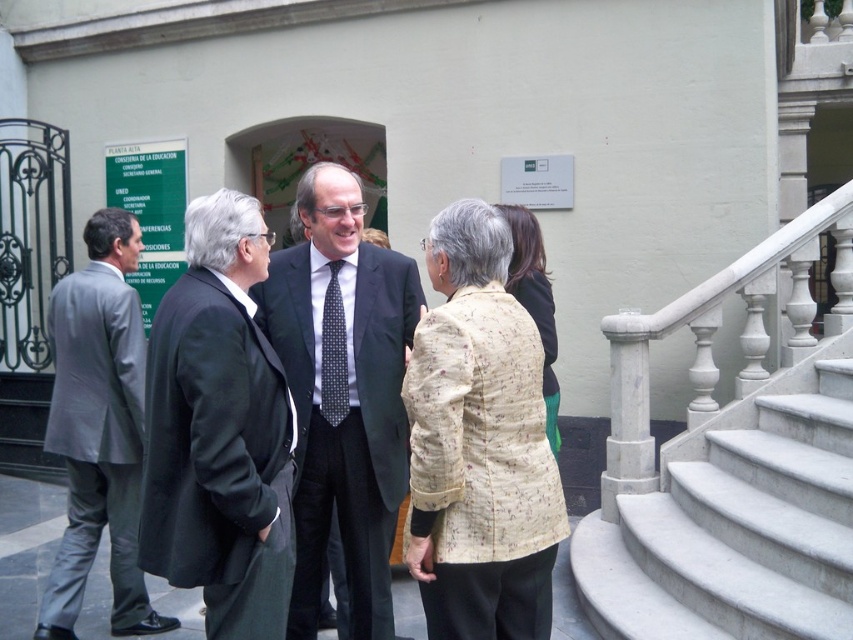
Question: Does black wool coat at center have a greater width compared to dark gray suit at center?

Choices:
 (A) yes
 (B) no

Answer: (B)

Question: Estimate the real-world distances between objects in this image. Which object is closer to the matte black suit at center?

Choices:
 (A) printed fabric jacket at center
 (B) black dotted tie at center
 (C) white marble stairs at lower right
 (D) floral-patterned fabric coat at center

Answer: (B)

Question: Estimate the real-world distances between objects in this image. Which object is farther from the floral-patterned fabric coat at center?

Choices:
 (A) white marble stairs at lower right
 (B) printed fabric jacket at center

Answer: (B)

Question: Considering the relative positions of white marble stairs at lower right and floral-patterned fabric coat at center in the image provided, where is white marble stairs at lower right located with respect to floral-patterned fabric coat at center?

Choices:
 (A) below
 (B) above

Answer: (A)

Question: Does printed fabric jacket at center appear under gray suit at left?

Choices:
 (A) yes
 (B) no

Answer: (B)

Question: Among these points, which one is nearest to the camera?

Choices:
 (A) (517, 234)
 (B) (44, 620)
 (C) (403, 323)

Answer: (C)